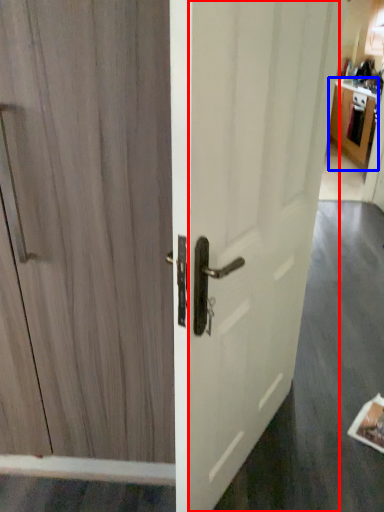
Question: Among these objects, which one is nearest to the camera, screen door (highlighted by a red box) or cabinetry (highlighted by a blue box)?

Choices:
 (A) screen door
 (B) cabinetry

Answer: (A)